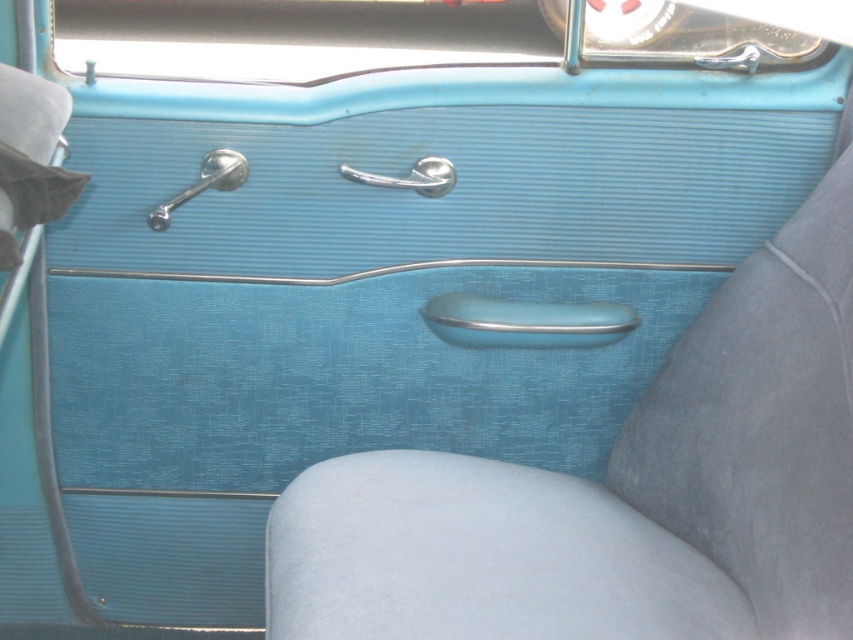
Can you confirm if metallic blue door handle at center is smaller than polished silver door handle at center?

No, metallic blue door handle at center is not smaller than polished silver door handle at center.

Describe the element at coordinates (524, 323) in the screenshot. This screenshot has width=853, height=640. I see `metallic blue door handle at center` at that location.

Does point (546, 333) come in front of point (434, 161)?

That is False.

Where is `metallic blue door handle at center`? This screenshot has height=640, width=853. metallic blue door handle at center is located at coordinates (524, 323).

Is point (227, 170) behind point (432, 166)?

No.

Who is more distant from viewer, (161, 224) or (357, 173)?

Point (357, 173)

Locate an element on the screen. Image resolution: width=853 pixels, height=640 pixels. polished chrome door handle at upper left is located at coordinates (204, 182).

Who is positioned more to the left, metallic blue door handle at center or polished chrome door handle at upper left?

Positioned to the left is polished chrome door handle at upper left.

Does metallic blue door handle at center appear under polished chrome door handle at upper left?

Yes, metallic blue door handle at center is below polished chrome door handle at upper left.

Is point (503, 346) farther from viewer compared to point (242, 164)?

That is True.

Find the location of a particular element. Image resolution: width=853 pixels, height=640 pixels. metallic blue door handle at center is located at coordinates (524, 323).